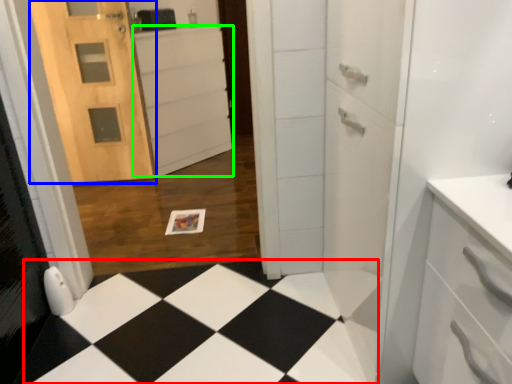
Question: Estimate the real-world distances between objects in this image. Which object is closer to square (highlighted by a red box), door (highlighted by a blue box) or cabinetry (highlighted by a green box)?

Choices:
 (A) door
 (B) cabinetry

Answer: (A)